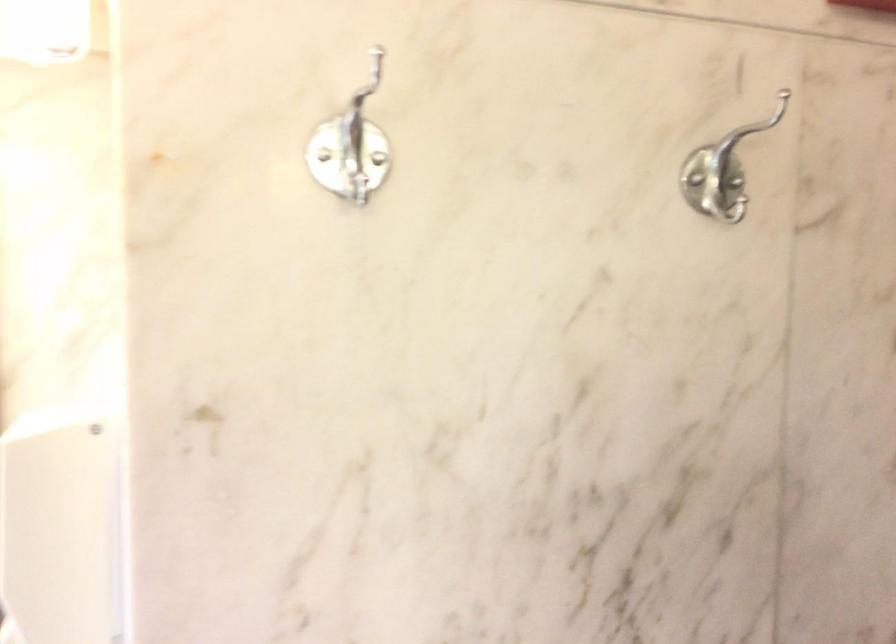
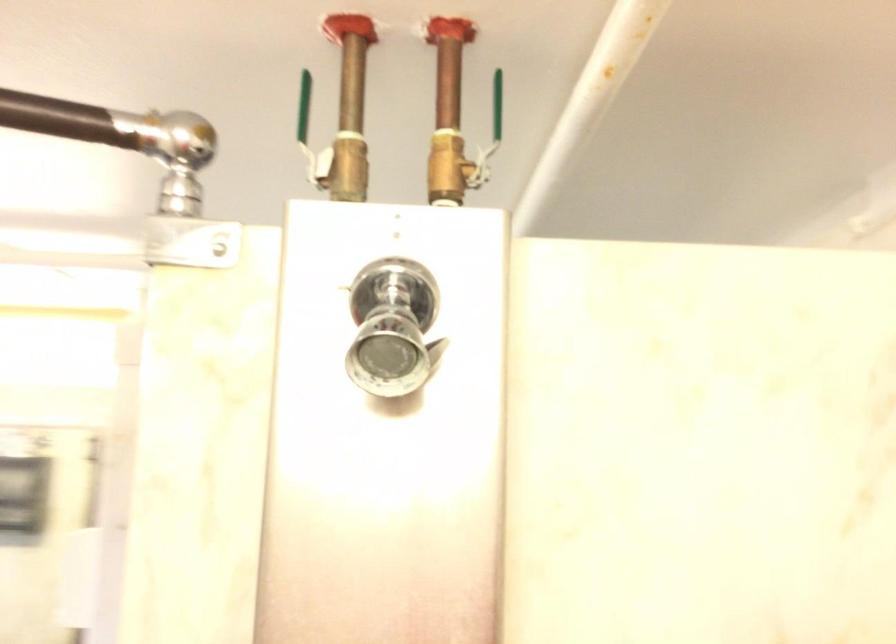
Question: I am providing you with two images of the same scene from different viewpoints. After the viewpoint changes to image2, which objects are now occluded?

Choices:
 (A) blue broom
 (B) metal coat hook
 (C) shower head lever
 (D) green valve handle

Answer: (B)